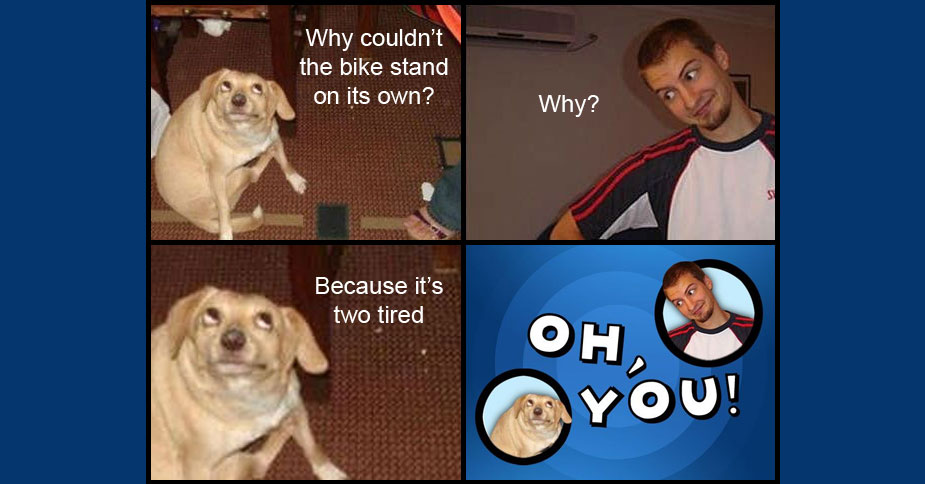
What are the coordinates of `chair` in the screenshot? It's located at (250, 12), (314, 249).